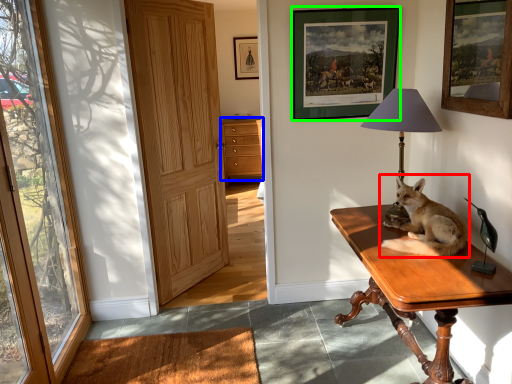
Question: Which object is positioned closest to dog (highlighted by a red box)? Select from cabinetry (highlighted by a blue box) and picture frame (highlighted by a green box).

Choices:
 (A) cabinetry
 (B) picture frame

Answer: (B)